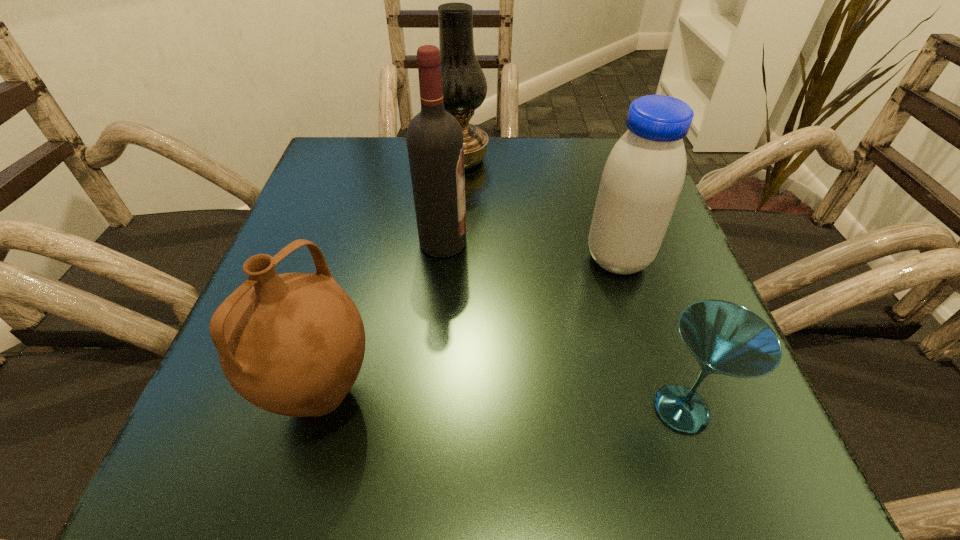
Locate an element on the screen. The height and width of the screenshot is (540, 960). free spot between the wine bottle and the leftmost object is located at coordinates (382, 319).

Locate an element on the screen. Image resolution: width=960 pixels, height=540 pixels. object identified as the fourth closest to the pitcher is located at coordinates (464, 84).

The height and width of the screenshot is (540, 960). In order to click on object that is the third nearest to the shortest object in this screenshot , I will do `click(293, 344)`.

Locate an element on the screen. The width and height of the screenshot is (960, 540). vacant space that satisfies the following two spatial constraints: 1. on the back side of the oil lamp; 2. on the left side of the pitcher is located at coordinates (387, 160).

Find the location of a particular element. The height and width of the screenshot is (540, 960). vacant space that satisfies the following two spatial constraints: 1. on the back side of the leftmost object; 2. on the left side of the oil lamp is located at coordinates (387, 160).

Where is `free spot that satisfies the following two spatial constraints: 1. on the back side of the oil lamp; 2. on the right side of the leftmost object`? The image size is (960, 540). free spot that satisfies the following two spatial constraints: 1. on the back side of the oil lamp; 2. on the right side of the leftmost object is located at coordinates (387, 160).